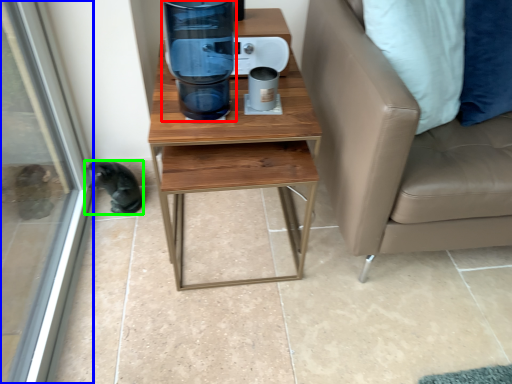
Question: Estimate the real-world distances between objects in this image. Which object is farther from water cooler (highlighted by a red box), screen door (highlighted by a blue box) or animal (highlighted by a green box)?

Choices:
 (A) screen door
 (B) animal

Answer: (A)